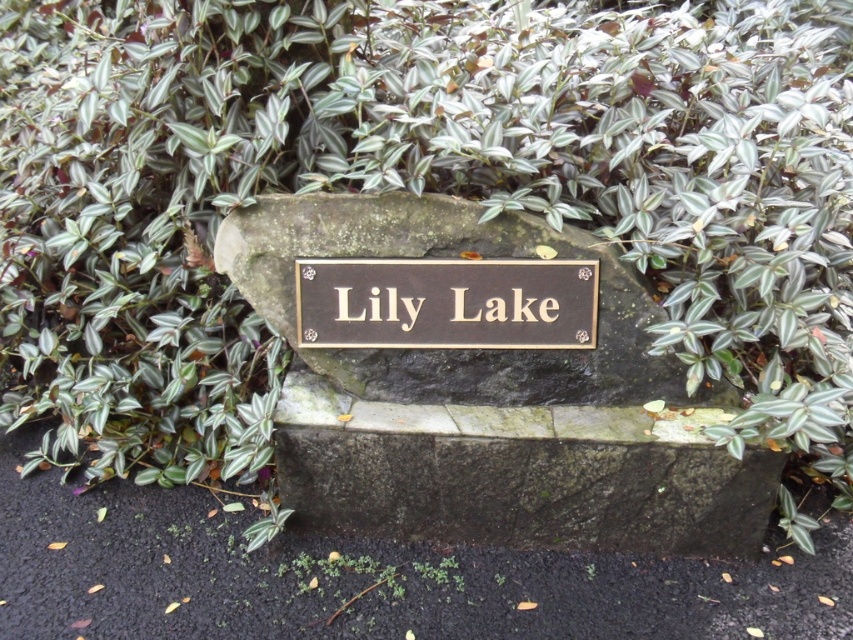
Question: Which of the following is the farthest from the observer?

Choices:
 (A) gold plated sign at center
 (B) gold metallic sign at center
 (C) gold metallic plaque at center

Answer: (B)

Question: Which of the following is the closest to the observer?

Choices:
 (A) (523, 355)
 (B) (471, 266)

Answer: (B)

Question: Can you confirm if gold plated sign at center is wider than gold metallic sign at center?

Choices:
 (A) no
 (B) yes

Answer: (B)

Question: Can you confirm if gold metallic plaque at center is positioned to the left of gold metallic sign at center?

Choices:
 (A) yes
 (B) no

Answer: (A)

Question: Does gold plated sign at center come in front of gold metallic sign at center?

Choices:
 (A) yes
 (B) no

Answer: (A)

Question: Among these points, which one is nearest to the camera?

Choices:
 (A) (387, 316)
 (B) (578, 344)
 (C) (456, 397)

Answer: (A)